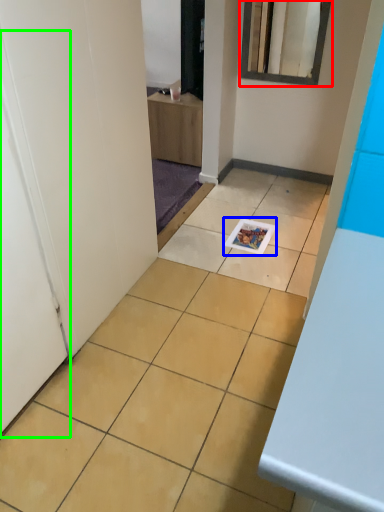
Question: Which is farther away from mirror (highlighted by a red box)? magazine (highlighted by a blue box) or door (highlighted by a green box)?

Choices:
 (A) magazine
 (B) door

Answer: (B)